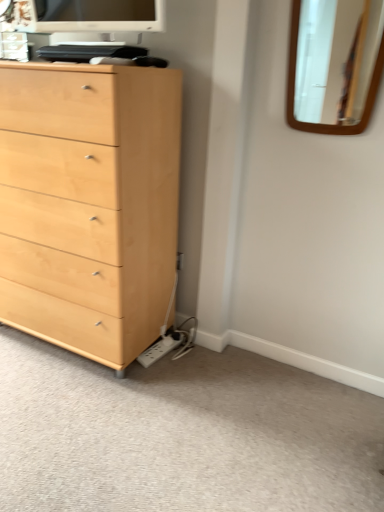
The width and height of the screenshot is (384, 512). Identify the location of light wood chest of drawers at left. (89, 205).

What do you see at coordinates (334, 64) in the screenshot? The width and height of the screenshot is (384, 512). I see `wooden mirror at upper right` at bounding box center [334, 64].

This screenshot has height=512, width=384. Describe the element at coordinates (182, 435) in the screenshot. I see `light brown wood dresser at lower left` at that location.

What is the approximate height of matte white monitor at upper center?

matte white monitor at upper center is 8.35 inches in height.

This screenshot has width=384, height=512. I want to click on light wood chest of drawers at left, so click(89, 205).

Which object is positioned more to the left, wooden mirror at upper right or matte white monitor at upper center?

matte white monitor at upper center.

Is matte white monitor at upper center at the back of wooden mirror at upper right?

That's not correct — wooden mirror at upper right is not looking away from matte white monitor at upper center.

Considering the sizes of wooden mirror at upper right and matte white monitor at upper center in the image, is wooden mirror at upper right taller or shorter than matte white monitor at upper center?

Clearly, wooden mirror at upper right is taller compared to matte white monitor at upper center.

From the picture: Is wooden mirror at upper right positioned far away from matte white monitor at upper center?

Yes, wooden mirror at upper right is far from matte white monitor at upper center.

This screenshot has height=512, width=384. Find the location of `computer monitor located above the light wood chest of drawers at left (from a real-world perspective)`. computer monitor located above the light wood chest of drawers at left (from a real-world perspective) is located at coordinates (98, 16).

Who is shorter, matte white monitor at upper center or light wood chest of drawers at left?

matte white monitor at upper center is shorter.

Is matte white monitor at upper center aimed at light wood chest of drawers at left?

No, matte white monitor at upper center is not facing towards light wood chest of drawers at left.

How different are the orientations of matte white monitor at upper center and light wood chest of drawers at left in degrees?

There is a 0.000572-degree angle between the facing directions of matte white monitor at upper center and light wood chest of drawers at left.

Considering the relative sizes of light wood chest of drawers at left and wooden mirror at upper right in the image provided, is light wood chest of drawers at left wider than wooden mirror at upper right?

Indeed, light wood chest of drawers at left has a greater width compared to wooden mirror at upper right.

Find the location of a particular element. Image resolution: width=384 pixels, height=512 pixels. mirror to the right of light wood chest of drawers at left is located at coordinates (334, 64).

What's the angular difference between light wood chest of drawers at left and wooden mirror at upper right's facing directions?

The angle between the facing direction of light wood chest of drawers at left and the facing direction of wooden mirror at upper right is 0.74 degrees.

Is light wood chest of drawers at left directly adjacent to wooden mirror at upper right?

No, light wood chest of drawers at left is not with wooden mirror at upper right.

Between light brown wood dresser at lower left and light wood chest of drawers at left, which one has larger size?

With larger size is light wood chest of drawers at left.

Consider the image. Is light brown wood dresser at lower left not inside light wood chest of drawers at left?

Yes, light brown wood dresser at lower left is not within light wood chest of drawers at left.

Consider the image. Can you confirm if light brown wood dresser at lower left is positioned to the left of light wood chest of drawers at left?

In fact, light brown wood dresser at lower left is to the right of light wood chest of drawers at left.

Find the location of a particular element. computer monitor on the right of the light wood chest of drawers at left is located at coordinates (98, 16).

Would you say light wood chest of drawers at left is outside matte white monitor at upper center?

Absolutely, light wood chest of drawers at left is external to matte white monitor at upper center.

Based on the photo, is light wood chest of drawers at left directly adjacent to matte white monitor at upper center?

light wood chest of drawers at left and matte white monitor at upper center are clearly separated.

Who is shorter, light wood chest of drawers at left or matte white monitor at upper center?

With less height is matte white monitor at upper center.

Which of these two, matte white monitor at upper center or light brown wood dresser at lower left, is wider?

Wider between the two is light brown wood dresser at lower left.

Do you think matte white monitor at upper center is within light brown wood dresser at lower left, or outside of it?

matte white monitor at upper center is spatially situated outside light brown wood dresser at lower left.

From the image's perspective, relative to light brown wood dresser at lower left, is matte white monitor at upper center above or below?

Based on their image positions, matte white monitor at upper center is located above light brown wood dresser at lower left.

From a real-world perspective, does light brown wood dresser at lower left sit lower than wooden mirror at upper right?

Yes, from a real-world perspective, light brown wood dresser at lower left is beneath wooden mirror at upper right.

Based on the photo, which object is positioned more to the left, light brown wood dresser at lower left or wooden mirror at upper right?

Positioned to the left is light brown wood dresser at lower left.

In terms of width, does light brown wood dresser at lower left look wider or thinner when compared to wooden mirror at upper right?

light brown wood dresser at lower left is wider than wooden mirror at upper right.

Would you say light brown wood dresser at lower left is outside wooden mirror at upper right?

Yes, light brown wood dresser at lower left is not within wooden mirror at upper right.

Identify the location of computer monitor located above the wooden mirror at upper right (from the image's perspective). (98, 16).

At what (x,y) coordinates should I click in order to perform the action: click on computer monitor behind the light wood chest of drawers at left. Please return your answer as a coordinate pair (x, y). This screenshot has width=384, height=512. Looking at the image, I should click on (98, 16).

Which object lies further to the anchor point light wood chest of drawers at left, light brown wood dresser at lower left or matte white monitor at upper center?

matte white monitor at upper center.

When comparing their distances from matte white monitor at upper center, does wooden mirror at upper right or light brown wood dresser at lower left seem closer?

The object closer to matte white monitor at upper center is light brown wood dresser at lower left.

From the image, which object appears to be farther from light brown wood dresser at lower left, matte white monitor at upper center or light wood chest of drawers at left?

Among the two, matte white monitor at upper center is located further to light brown wood dresser at lower left.

Which object lies nearer to the anchor point light wood chest of drawers at left, matte white monitor at upper center or wooden mirror at upper right?

The object closer to light wood chest of drawers at left is matte white monitor at upper center.

Consider the image. When comparing their distances from matte white monitor at upper center, does light wood chest of drawers at left or light brown wood dresser at lower left seem further?

light brown wood dresser at lower left is positioned further to the anchor matte white monitor at upper center.

Considering their positions, is light brown wood dresser at lower left positioned further to wooden mirror at upper right than matte white monitor at upper center?

The object further to wooden mirror at upper right is light brown wood dresser at lower left.

Looking at this image, when comparing their distances from matte white monitor at upper center, does light brown wood dresser at lower left or light wood chest of drawers at left seem closer?

Among the two, light wood chest of drawers at left is located nearer to matte white monitor at upper center.

Based on the photo, considering their positions, is light wood chest of drawers at left positioned closer to light brown wood dresser at lower left than wooden mirror at upper right?

light wood chest of drawers at left.

Image resolution: width=384 pixels, height=512 pixels. I want to click on chest of drawers between wooden mirror at upper right and light brown wood dresser at lower left in the vertical direction, so click(x=89, y=205).

Find the location of a particular element. computer monitor between light wood chest of drawers at left and wooden mirror at upper right in the horizontal direction is located at coordinates (98, 16).

Where is `the chest of drawers between matte white monitor at upper center and light brown wood dresser at lower left vertically`? The image size is (384, 512). the chest of drawers between matte white monitor at upper center and light brown wood dresser at lower left vertically is located at coordinates (89, 205).

Locate an element on the screen. The height and width of the screenshot is (512, 384). mirror that lies between matte white monitor at upper center and light brown wood dresser at lower left from top to bottom is located at coordinates (334, 64).